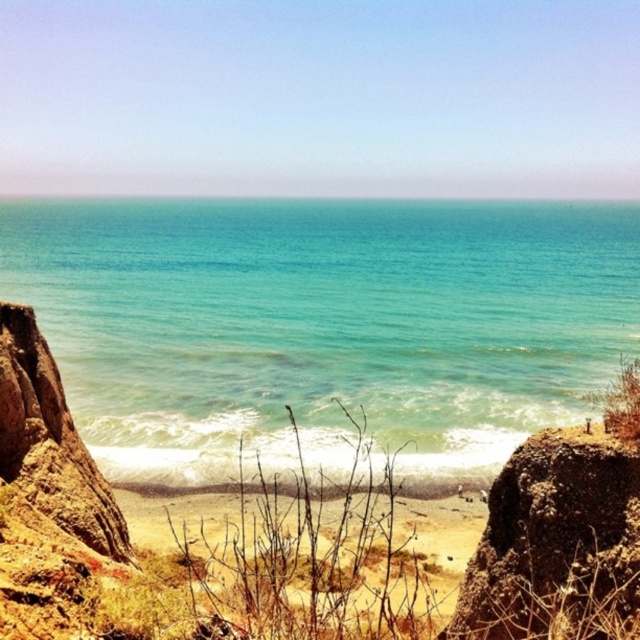
Question: Which object is farther from the camera taking this photo?

Choices:
 (A) clear blue water at center
 (B) brown rough rock at lower right

Answer: (A)

Question: Is clear blue water at center bigger than brown rough rock at lower right?

Choices:
 (A) yes
 (B) no

Answer: (A)

Question: Which object is farther from the camera taking this photo?

Choices:
 (A) clear blue water at center
 (B) brown rough rock at lower right

Answer: (A)

Question: Can you confirm if clear blue water at center is thinner than brown rough rock at lower right?

Choices:
 (A) no
 (B) yes

Answer: (A)

Question: Can you confirm if clear blue water at center is positioned below brown rough rock at lower right?

Choices:
 (A) no
 (B) yes

Answer: (A)